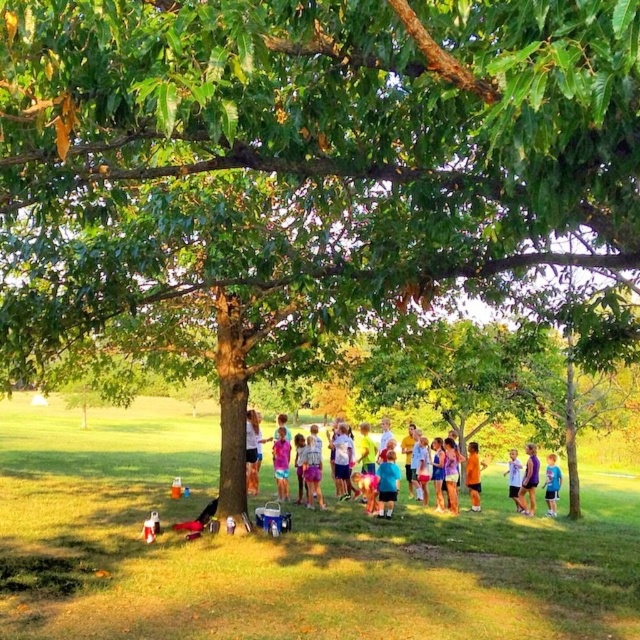
You are a photographer standing at the edge of the scene and want to take a photo that includes both the blue cotton shirt at lower right and the purple cotton shirt at center. Based on their positions, which shirt should you adjust your camera angle to focus on first to ensure both are in the frame?

The blue cotton shirt at lower right is positioned on the right side of purple cotton shirt at center. To include both in the frame, you should first focus on the blue cotton shirt at lower right, as it is on the outer edge, ensuring the purple cotton shirt at center remains centered within the shot.

You are standing at the camera position and want to toss a ball to the person wearing the purple cotton shirt at lower right. If the ball travels in a straight line, will it pass over the tree branches above?

The purple cotton shirt at lower right is 17.78 meters away from the camera. Since the tree branches are above the camera position and the distance is quite far, the ball would likely arc high enough to pass over the tree branches. However, without knowing the exact height of the branches or the ball trajectory, this is an approximation.

You are standing at the center of the scene and want to hand a water bottle to the person wearing the white cotton shirt at center. Which direction should you move to reach them?

The white cotton shirt at center is located at point 0.705 on the x axis and 0.395 on the y axis. Since you are at the center of the scene, you should move towards the right and slightly downward to reach the white cotton shirt at center.